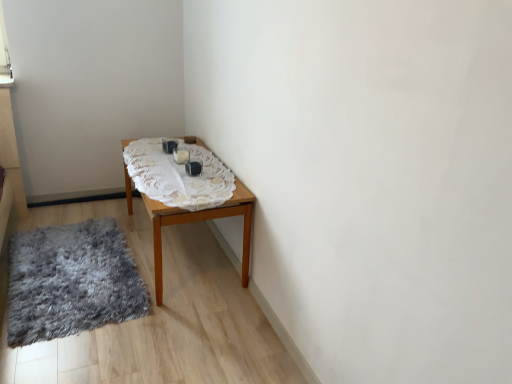
I want to click on vacant area on top of wooden table at center (from a real-world perspective), so (x=183, y=162).